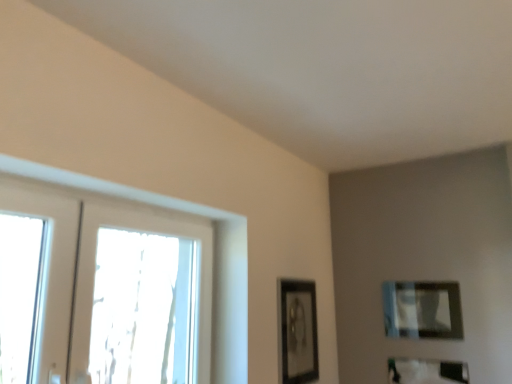
Question: Is the position of matte black picture frame at upper right, which is counted as the 2th picture frame, starting from the left, more distant than that of matte black picture frame at lower right, the 3th picture frame viewed from the left?

Choices:
 (A) yes
 (B) no

Answer: (A)

Question: Can you confirm if matte black picture frame at upper right, which is counted as the 2th picture frame, starting from the left, is taller than matte black picture frame at lower right, marked as the 1th picture frame in a right-to-left arrangement?

Choices:
 (A) yes
 (B) no

Answer: (A)

Question: From the image's perspective, is matte black picture frame at upper right, which is counted as the 2th picture frame, starting from the right, under matte black picture frame at lower right, marked as the 1th picture frame in a right-to-left arrangement?

Choices:
 (A) yes
 (B) no

Answer: (B)

Question: Is matte black picture frame at upper right, which is counted as the 2th picture frame, starting from the right, not close to matte black picture frame at lower right, marked as the 1th picture frame in a right-to-left arrangement?

Choices:
 (A) yes
 (B) no

Answer: (B)

Question: From a real-world perspective, is matte black picture frame at upper right, which is counted as the 2th picture frame, starting from the left, positioned over matte black picture frame at lower right, marked as the 1th picture frame in a right-to-left arrangement, based on gravity?

Choices:
 (A) yes
 (B) no

Answer: (A)

Question: Is matte black picture frame at upper right, which is counted as the 2th picture frame, starting from the left, at the right side of matte black picture frame at lower right, the 3th picture frame viewed from the left?

Choices:
 (A) yes
 (B) no

Answer: (B)

Question: Can we say matte black picture frame at lower right, marked as the 1th picture frame in a right-to-left arrangement, lies outside matte black picture frame at upper right, which is counted as the 2th picture frame, starting from the left?

Choices:
 (A) no
 (B) yes

Answer: (B)

Question: Is matte black picture frame at lower right, the 3th picture frame viewed from the left, closer to the viewer compared to matte black picture frame at upper right, which is counted as the 2th picture frame, starting from the right?

Choices:
 (A) no
 (B) yes

Answer: (B)

Question: Considering the relative sizes of matte black picture frame at lower right, the 3th picture frame viewed from the left, and matte black picture frame at upper right, which is counted as the 2th picture frame, starting from the left, in the image provided, is matte black picture frame at lower right, the 3th picture frame viewed from the left, smaller than matte black picture frame at upper right, which is counted as the 2th picture frame, starting from the left,?

Choices:
 (A) yes
 (B) no

Answer: (A)

Question: Can matte black picture frame at upper right, which is counted as the 2th picture frame, starting from the right, be found inside matte black picture frame at lower right, marked as the 1th picture frame in a right-to-left arrangement?

Choices:
 (A) no
 (B) yes

Answer: (A)

Question: Considering the relative positions of matte black picture frame at lower right, marked as the 1th picture frame in a right-to-left arrangement, and matte black picture frame at upper right, which is counted as the 2th picture frame, starting from the right, in the image provided, is matte black picture frame at lower right, marked as the 1th picture frame in a right-to-left arrangement, to the left of matte black picture frame at upper right, which is counted as the 2th picture frame, starting from the right, from the viewer's perspective?

Choices:
 (A) yes
 (B) no

Answer: (B)

Question: From a real-world perspective, is matte black picture frame at lower right, marked as the 1th picture frame in a right-to-left arrangement, over matte black picture frame at upper right, which is counted as the 2th picture frame, starting from the right?

Choices:
 (A) no
 (B) yes

Answer: (A)

Question: From a real-world perspective, is clear glass window at left positioned over matte black picture frame at upper right, which is counted as the 2th picture frame, starting from the left, based on gravity?

Choices:
 (A) no
 (B) yes

Answer: (B)